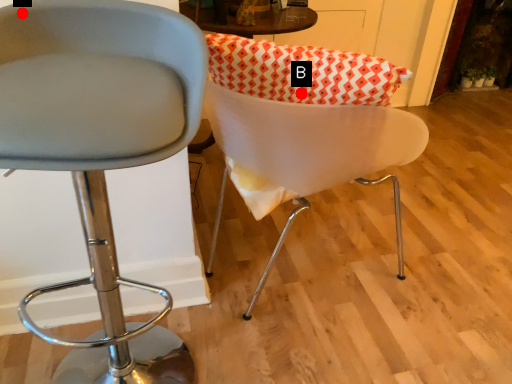
Question: Two points are circled on the image, labeled by A and B beside each circle. Which point is closer to the camera?

Choices:
 (A) A is closer
 (B) B is closer

Answer: (A)